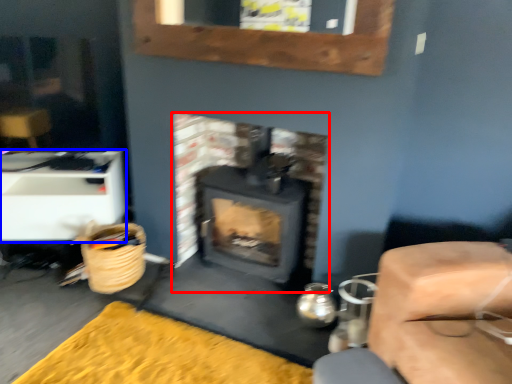
Question: Among these objects, which one is nearest to the camera, wood burning stove (highlighted by a red box) or furniture (highlighted by a blue box)?

Choices:
 (A) wood burning stove
 (B) furniture

Answer: (A)